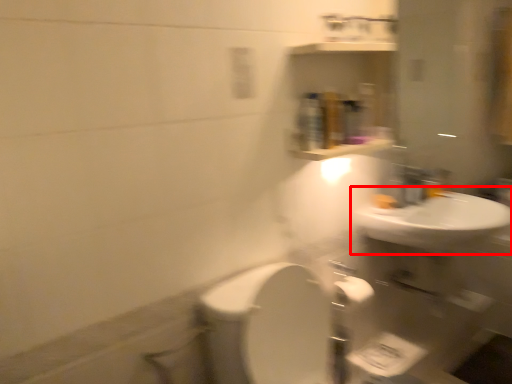
Question: From the image, what is the correct spatial relationship of sink (annotated by the red box) in relation to faucet?

Choices:
 (A) left
 (B) right

Answer: (B)